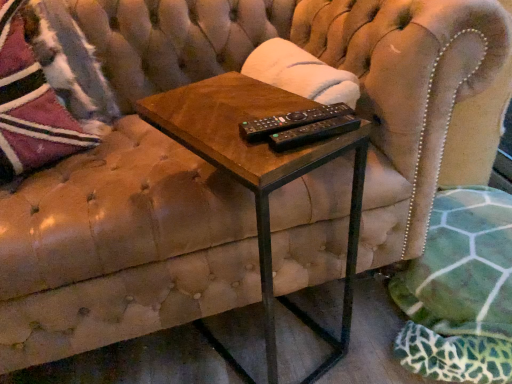
Locate an element on the screen. This screenshot has height=384, width=512. free space to the back side of black plastic remote at center is located at coordinates (268, 101).